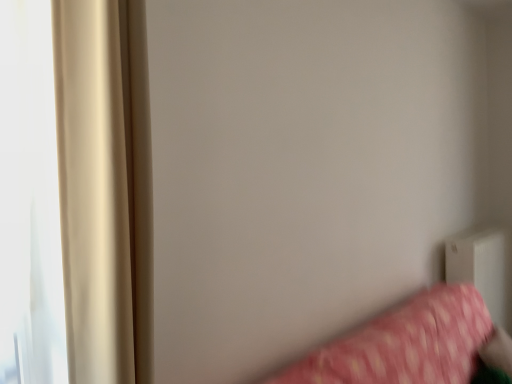
Question: Is pink fabric bed at lower right spatially inside white plastic radiator at lower right, or outside of it?

Choices:
 (A) inside
 (B) outside

Answer: (B)

Question: Considering the positions of point [422, 317] and point [502, 316], is point [422, 317] closer or farther from the camera than point [502, 316]?

Choices:
 (A) closer
 (B) farther

Answer: (A)

Question: Based on their relative distances, which object is nearer to the white plastic radiator at lower right?

Choices:
 (A) beige satin curtain at left
 (B) pink fabric bed at lower right

Answer: (B)

Question: Which is nearer to the beige satin curtain at left?

Choices:
 (A) white plastic radiator at lower right
 (B) pink fabric bed at lower right

Answer: (B)